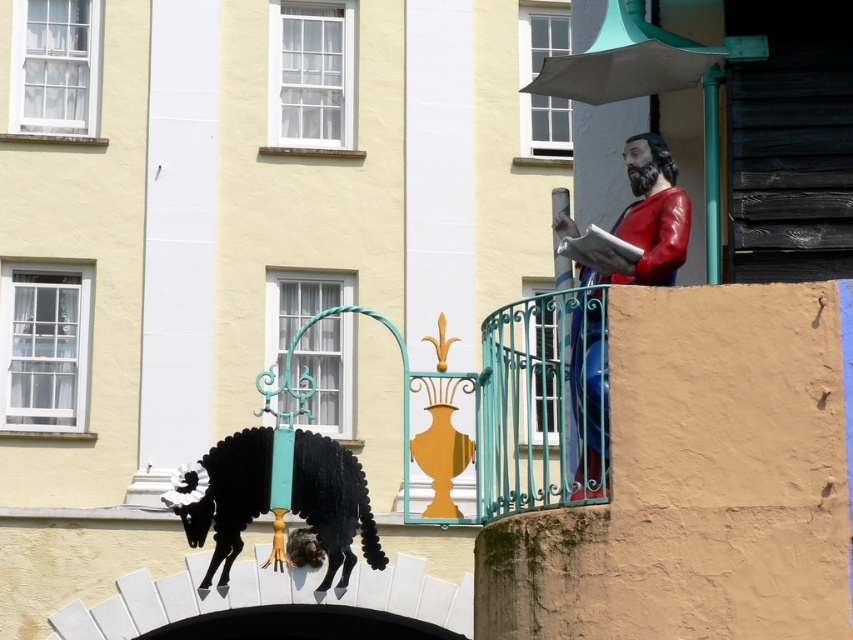
You are standing at the base of the building and looking towards the decorative archway. There are two points marked on the building wall. One is at point (222,573) and the other is at point (654,173). Which point is closer to you?

Point (654,173) is closer to you because it is in front of point (222,573).

You are an art curator planning to install a new sculpture in the space between the black matte ram at lower left and the shiny red statue at upper right. Considering their widths, which object will require more space horizontally for the installation?

The black matte ram at lower left requires more horizontal space because its width surpasses that of the shiny red statue at upper right.

You are standing at the base of the building and want to take a photo of the black matte ram at lower left. If your camera has a maximum focus range of 40 meters, will it be able to capture the ram clearly?

The black matte ram at lower left is 38.39 meters away from the camera. Since the camera can focus up to 40 meters, it will be able to capture the ram clearly within its maximum focus range.